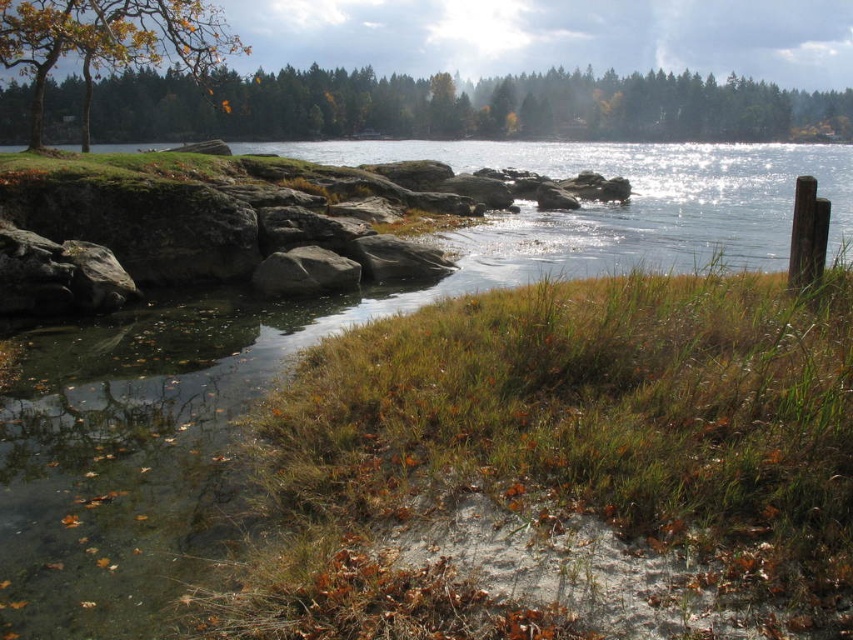
The image size is (853, 640). In order to click on green matte tree at upper center in this screenshot , I will do `click(461, 108)`.

The image size is (853, 640). What are the coordinates of `green matte tree at upper center` in the screenshot? It's located at (461, 108).

Can you confirm if brown textured tree at upper left is positioned above gray rough rock at center?

Correct, brown textured tree at upper left is located above gray rough rock at center.

Who is positioned more to the right, brown textured tree at upper left or gray rough rock at center?

gray rough rock at center is more to the right.

Find the location of a particular element. The image size is (853, 640). brown textured tree at upper left is located at coordinates (109, 38).

Locate an element on the screen. brown textured tree at upper left is located at coordinates (109, 38).

Who is positioned more to the right, green matte tree at upper center or brown textured tree at upper left?

Positioned to the right is green matte tree at upper center.

Is green matte tree at upper center bigger than brown textured tree at upper left?

Actually, green matte tree at upper center might be smaller than brown textured tree at upper left.

Which is in front, point (450, 116) or point (38, 141)?

Point (38, 141) is more forward.

In order to click on green matte tree at upper center in this screenshot , I will do `click(461, 108)`.